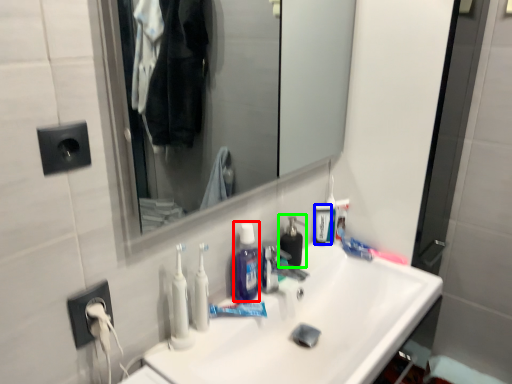
Question: Based on their relative distances, which object is farther from mouthwash (highlighted by a red box)? Choose from mouthwash (highlighted by a blue box) and soap dispenser (highlighted by a green box).

Choices:
 (A) mouthwash
 (B) soap dispenser

Answer: (A)